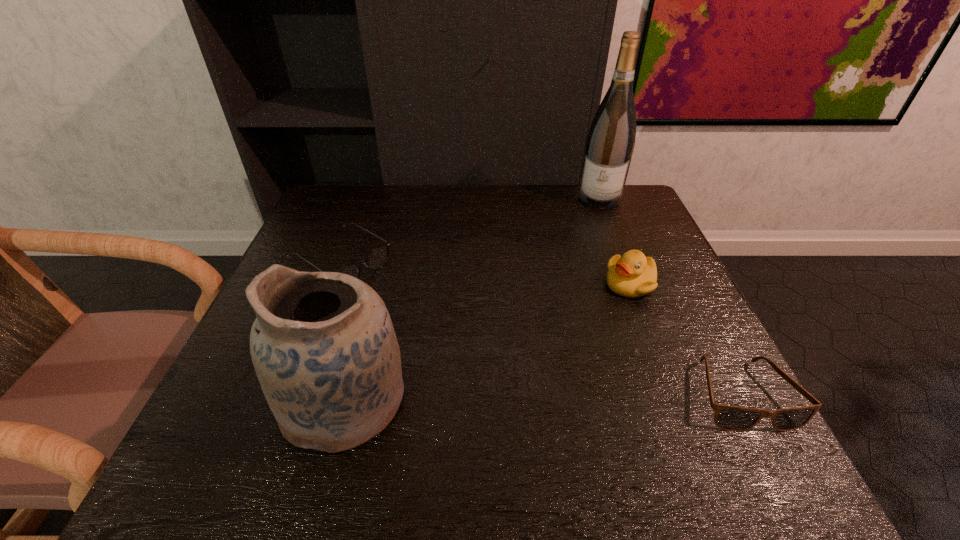
Where is `vacant space at the far left corner of the desktop`? The height and width of the screenshot is (540, 960). vacant space at the far left corner of the desktop is located at coordinates (364, 231).

The image size is (960, 540). I want to click on vacant space at the near left corner, so click(227, 417).

This screenshot has height=540, width=960. In the image, there is a desktop. In order to click on vacant region at the far right corner in this screenshot , I will do `click(617, 207)`.

Where is `free spot between the third shortest object and the second tallest object`? This screenshot has height=540, width=960. free spot between the third shortest object and the second tallest object is located at coordinates (488, 341).

You are a GUI agent. You are given a task and a screenshot of the screen. Output one action in this format:
    pyautogui.click(x=<x>, y=<y>)
    Task: Click on the free space between the sunglasses and the third shortest object
    This screenshot has width=960, height=540.
    Given the screenshot: What is the action you would take?
    pyautogui.click(x=685, y=339)

In order to click on vacant area that lies between the second tallest object and the third shortest object in this screenshot , I will do `click(488, 341)`.

Find the location of a particular element. This screenshot has height=540, width=960. blank region between the spectacles and the farthest object is located at coordinates tap(470, 230).

The image size is (960, 540). What are the coordinates of `free spot between the third shortest object and the pottery` in the screenshot? It's located at (488, 341).

Locate an element on the screen. The height and width of the screenshot is (540, 960). vacant space that is in between the sunglasses and the spectacles is located at coordinates (541, 328).

Find the location of a particular element. The width and height of the screenshot is (960, 540). unoccupied position between the sunglasses and the fourth shortest object is located at coordinates (542, 397).